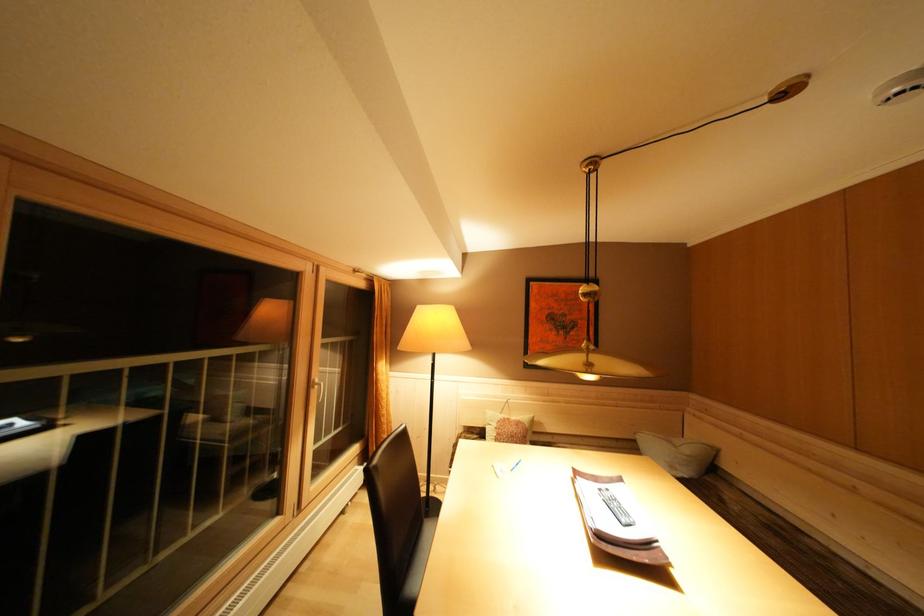
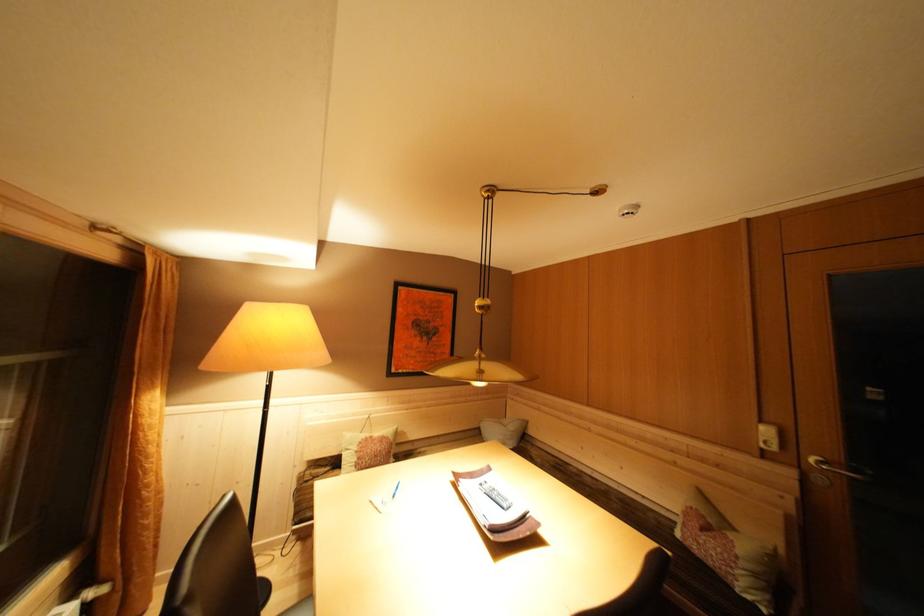
In the second image, find the point that corresponds to point (608, 495) in the first image.

(488, 488)